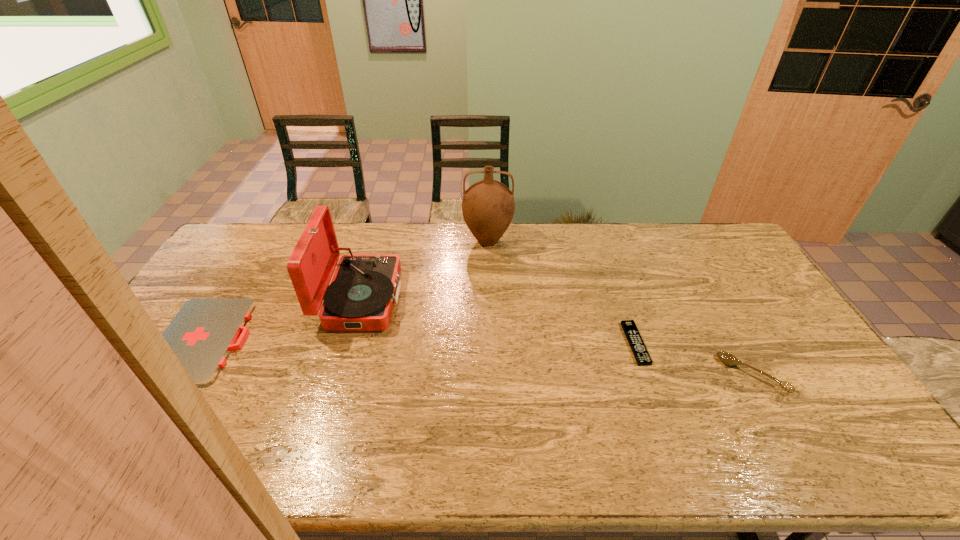
This screenshot has height=540, width=960. In the image, there is a desktop. In order to click on vacant space at the right edge in this screenshot , I will do pos(746,313).

This screenshot has width=960, height=540. In order to click on vacant space at the far left corner of the desktop in this screenshot , I will do `click(262, 249)`.

The image size is (960, 540). In the image, there is a desktop. What are the coordinates of `vacant space at the far right corner` in the screenshot? It's located at tap(715, 222).

Locate an element on the screen. This screenshot has height=540, width=960. vacant space that's between the phonograph_record and the second shortest object is located at coordinates (283, 320).

I want to click on empty space between the second object from left to right and the ladle, so click(557, 336).

At what (x,y) coordinates should I click in order to perform the action: click on vacant space that is in between the second object from left to right and the second shortest object. Please return your answer as a coordinate pair (x, y). The width and height of the screenshot is (960, 540). Looking at the image, I should click on (283, 320).

I want to click on unoccupied position between the leftmost object and the second object from right to left, so tap(420, 342).

Identify the location of empty space between the fourth object from left to right and the rightmost object. The width and height of the screenshot is (960, 540). (694, 359).

Identify the location of unoccupied area between the phonograph_record and the first-aid kit. (283, 320).

You are a GUI agent. You are given a task and a screenshot of the screen. Output one action in this format:
    pyautogui.click(x=<x>, y=<y>)
    Task: Click on the vacant region between the third tallest object and the phonograph_record
    
    Given the screenshot: What is the action you would take?
    pyautogui.click(x=557, y=336)